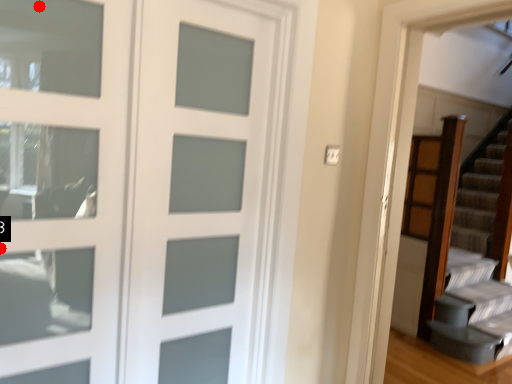
Question: Two points are circled on the image, labeled by A and B beside each circle. Which of the following is the farthest from the observer?

Choices:
 (A) A is further
 (B) B is further

Answer: (B)